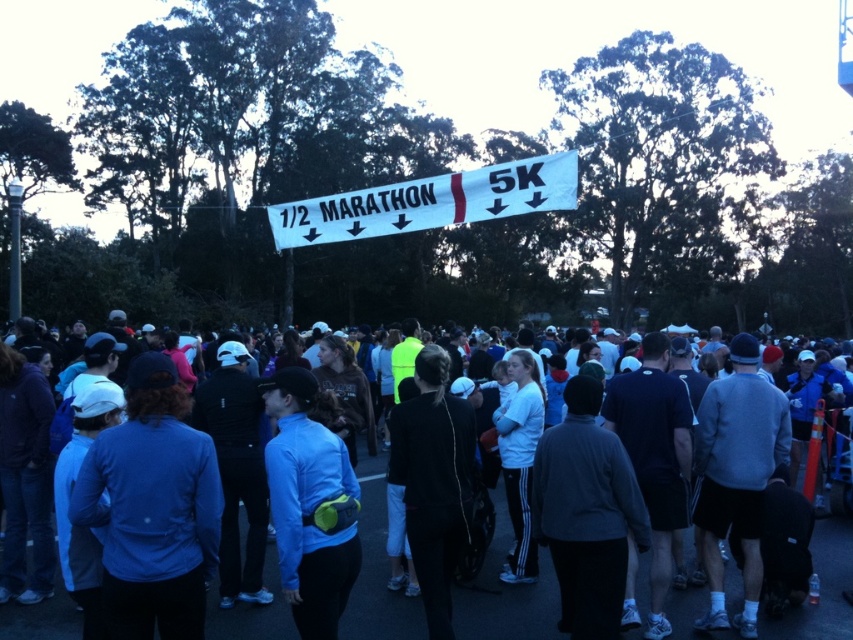
Can you confirm if dark blue fleece at center is positioned to the left of white fabric banner at center?

Incorrect, dark blue fleece at center is not on the left side of white fabric banner at center.

Does dark blue fleece at center lie in front of white fabric banner at center?

That is True.

You are a GUI agent. You are given a task and a screenshot of the screen. Output one action in this format:
    pyautogui.click(x=<x>, y=<y>)
    Task: Click on the dark blue fleece at center
    This screenshot has width=853, height=640.
    Given the screenshot: What is the action you would take?
    pyautogui.click(x=506, y=595)

Image resolution: width=853 pixels, height=640 pixels. I want to click on dark blue fleece at center, so pyautogui.click(x=506, y=595).